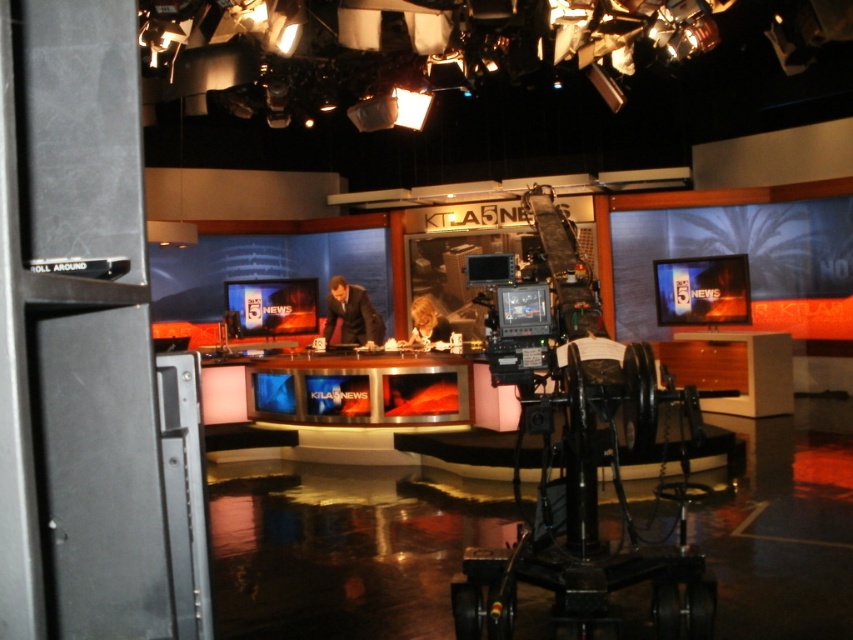
You are a camera operator in a news studio. You need to adjust the camera to focus on a specific point marked at point [508,289]. The camera is currently positioned 11.87 feet away from this point. Is the camera close enough to capture the point clearly without needing to move closer?

The camera is positioned 11.87 feet away from point [508,289]. This distance is sufficient for capturing the point clearly without needing to move closer, as standard studio cameras can focus effectively at such distances.

You are a news director observing the studio setup. You notice the black matte video camera at center and the dark suit at center. Which object is higher in elevation?

The black matte video camera at center is positioned over the dark suit at center, so it is higher in elevation.